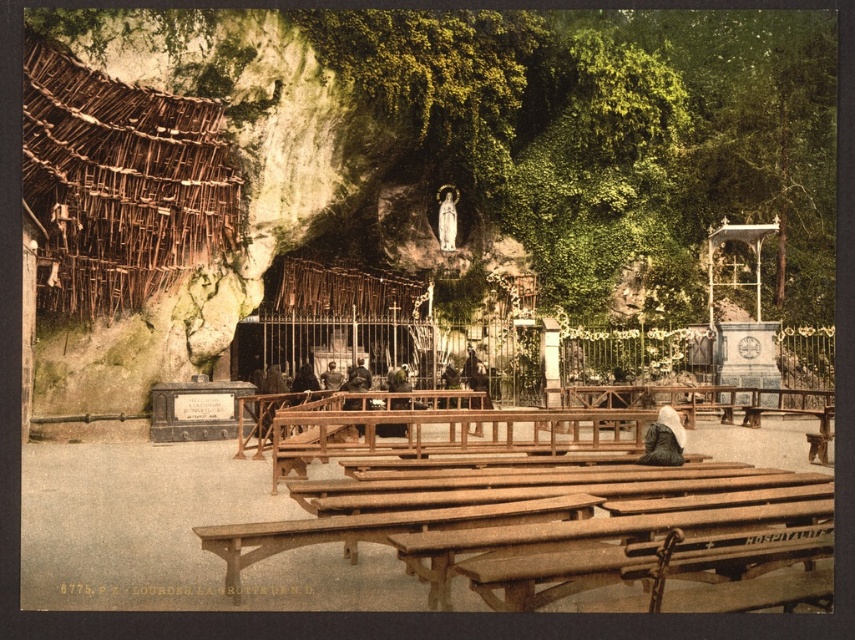
You are visiting this historical site and want to sit down to rest. You see a wooden park bench at lower center and a dark brown leather jacket at center. Which object is taller and can you sit on it?

The wooden park bench at lower center is much taller than the dark brown leather jacket at center, so you can sit on the wooden park bench at lower center.

You are standing at the entrance of the historical site and see the wooden park bench at lower center located at point [576,536]. If you want to sit down, which direction should you move to reach the wooden park bench at lower center?

The wooden park bench at lower center is located at point [576,536], so you should move towards the lower center direction to reach it.

You are visiting a historical religious site and notice two central elements in the scene described. The dark gray woolen robe at center and the white statue at center. Which of these two objects is taller?

The dark gray woolen robe at center is taller than the white statue at center.